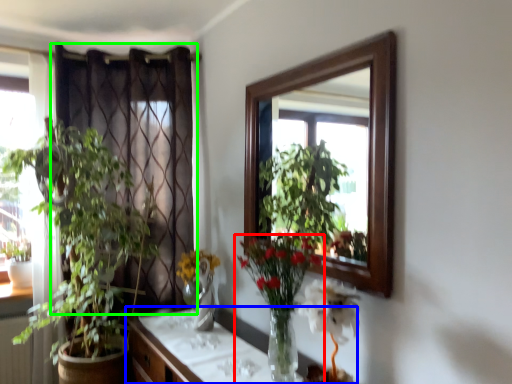
Question: Considering the real-world distances, which object is farthest from houseplant (highlighted by a red box)? cabinetry (highlighted by a blue box) or curtain (highlighted by a green box)?

Choices:
 (A) cabinetry
 (B) curtain

Answer: (B)